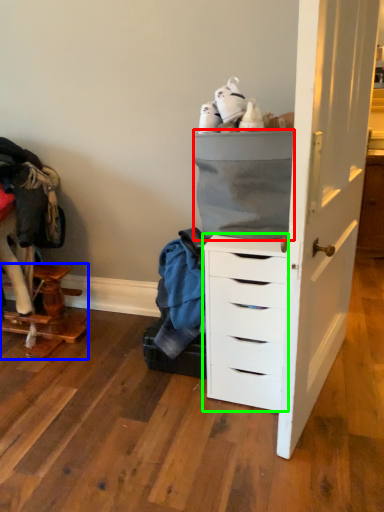
Question: Which object is positioned farthest from cabinetry (highlighted by a red box)? Select from furniture (highlighted by a blue box) and chest of drawers (highlighted by a green box).

Choices:
 (A) furniture
 (B) chest of drawers

Answer: (A)